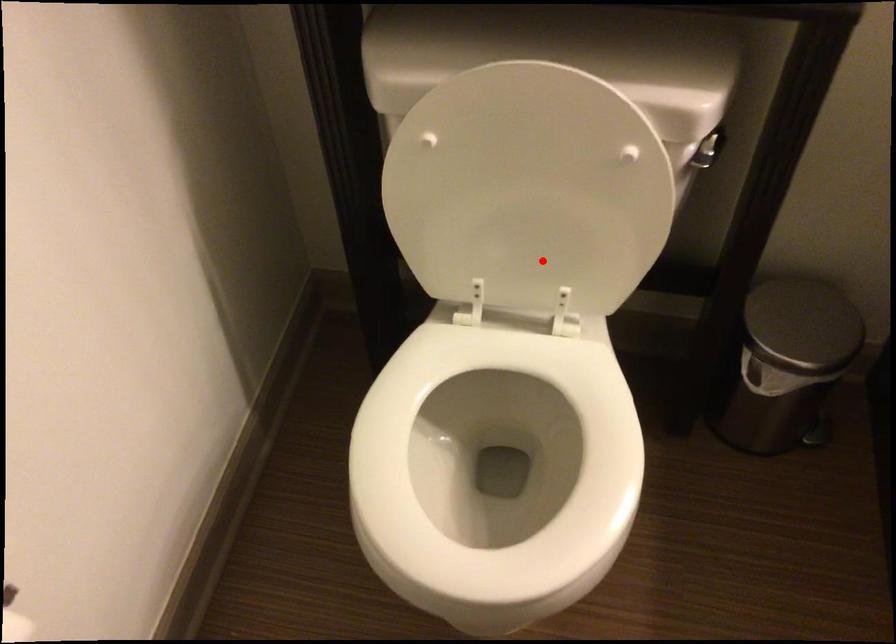
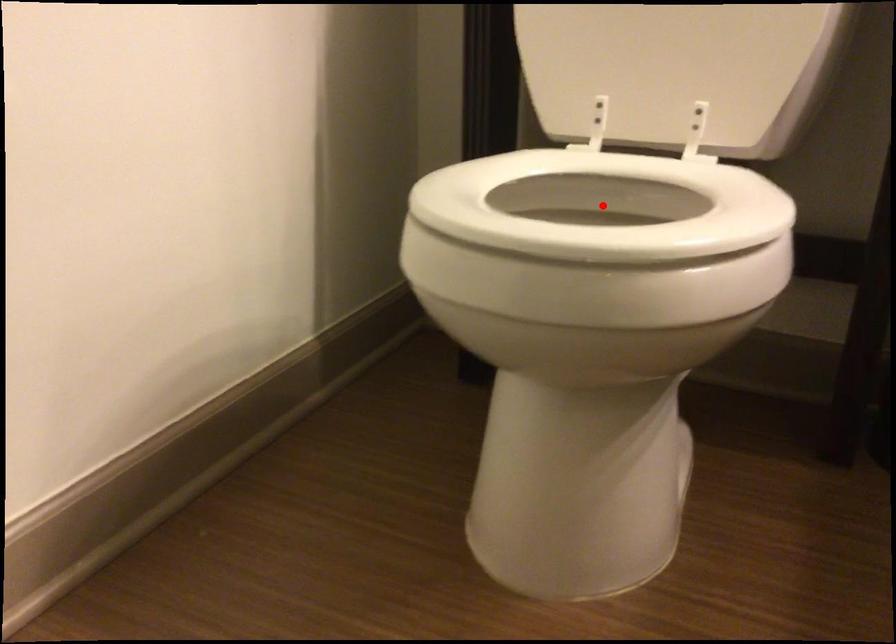
I am providing you with two images of the same scene from different viewpoints. A red point is marked on the first image and another point is marked on the second image. Does the point marked in image1 correspond to the same location as the one in image2?

No